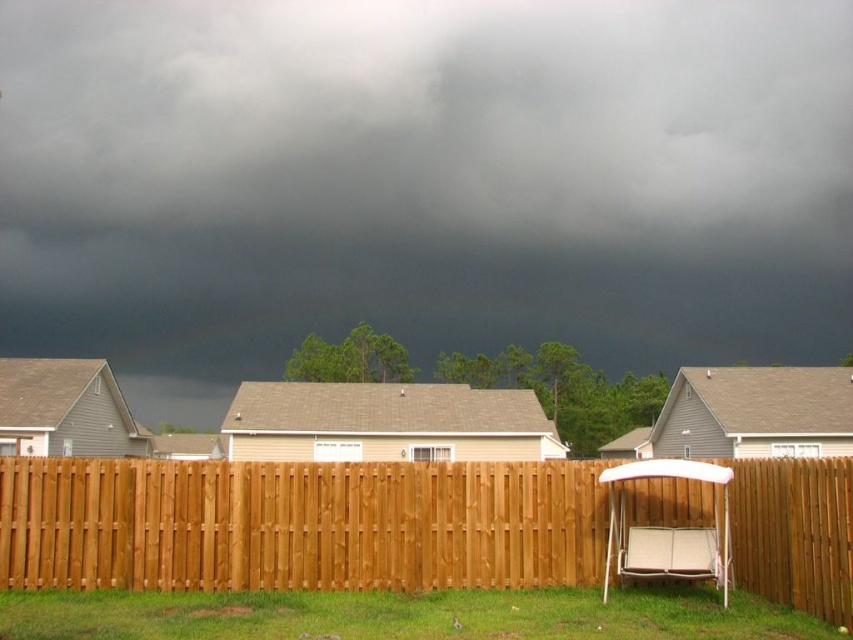
Question: Considering the real-world distances, which object is farthest from the green grass at lower center?

Choices:
 (A) dark gray cloud at upper center
 (B) brown wooden fence at center

Answer: (A)

Question: Observing the image, what is the correct spatial positioning of dark gray cloud at upper center in reference to green grass at lower center?

Choices:
 (A) right
 (B) left

Answer: (B)

Question: Is brown wooden fence at center wider than green grass at lower center?

Choices:
 (A) no
 (B) yes

Answer: (B)

Question: Which object is the farthest from the green grass at lower center?

Choices:
 (A) brown wooden fence at center
 (B) dark gray cloud at upper center

Answer: (B)

Question: Which is farther from the green grass at lower center?

Choices:
 (A) dark gray cloud at upper center
 (B) brown wooden fence at center

Answer: (A)

Question: Considering the relative positions of brown wooden fence at center and green grass at lower center in the image provided, where is brown wooden fence at center located with respect to green grass at lower center?

Choices:
 (A) below
 (B) above

Answer: (B)